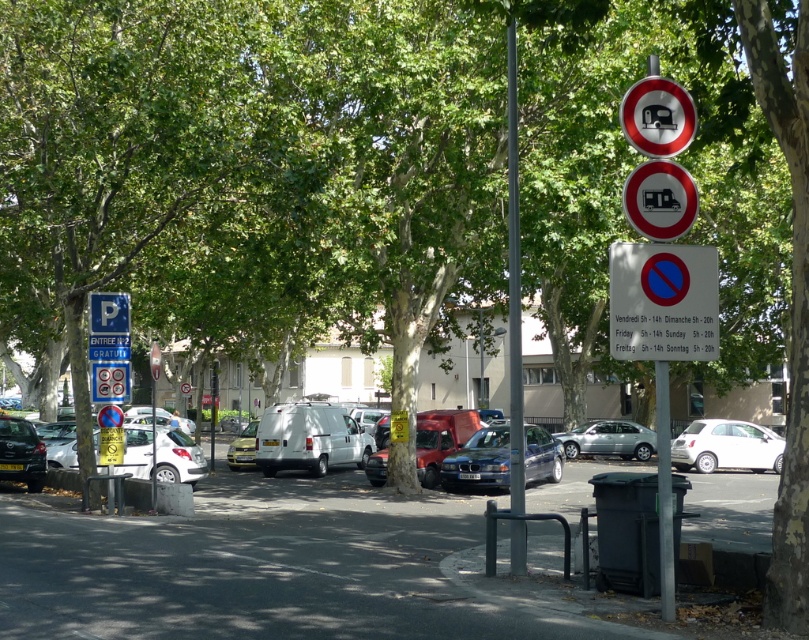
You are a driver parking your car in the shaded parking area. You see the white plastic sign at center and the silver metallic sedan at center. Which object is shorter in height?

The white plastic sign at center has a lesser height compared to the silver metallic sedan at center, so the white plastic sign at center is shorter.

You are a delivery driver in a van that weighs 4 tons. You see the parking area shaded by large trees and a sign. Can you park your van here according to the sign at point (x=663, y=301)?

The white plastic sign at center indicates that parking is restricted for vehicles over 3.5 tons on Fridays from 5 AM to 2 PM. Since your van weighs 4 tons, it exceeds the weight limit, so you cannot park here during those times.